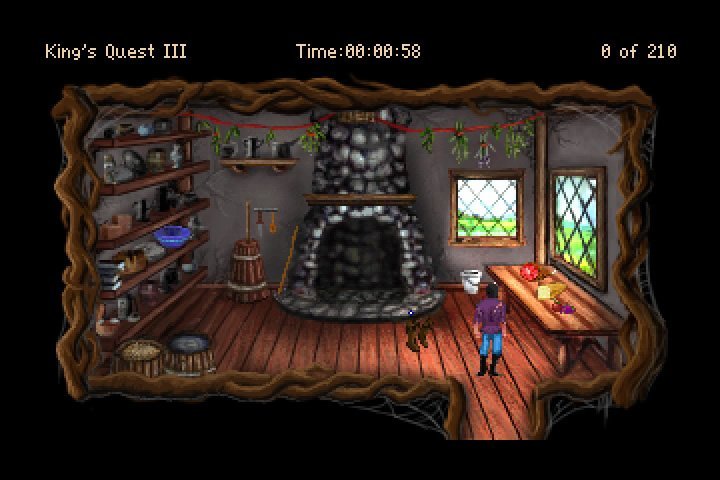
The width and height of the screenshot is (720, 480). Find the location of `table`. table is located at coordinates (595, 308).